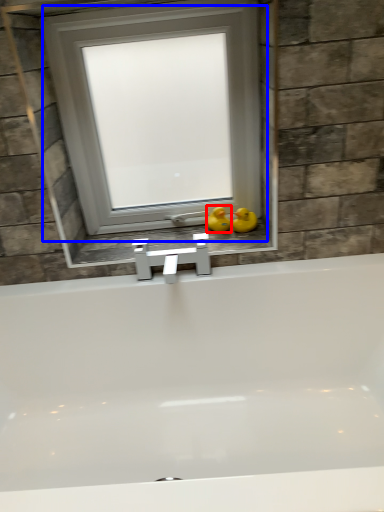
Question: Which of the following is the closest to the observer, duck (highlighted by a red box) or window (highlighted by a blue box)?

Choices:
 (A) duck
 (B) window

Answer: (B)